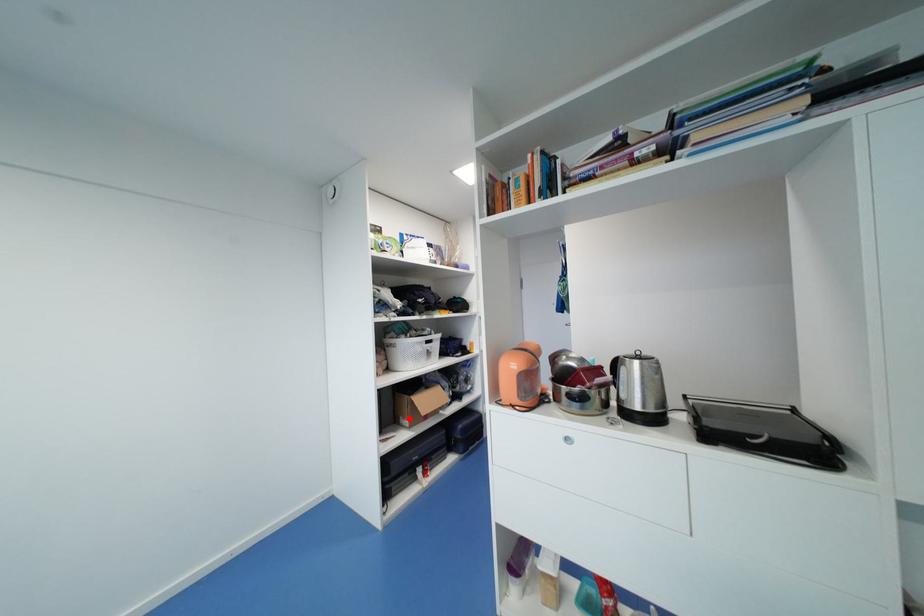
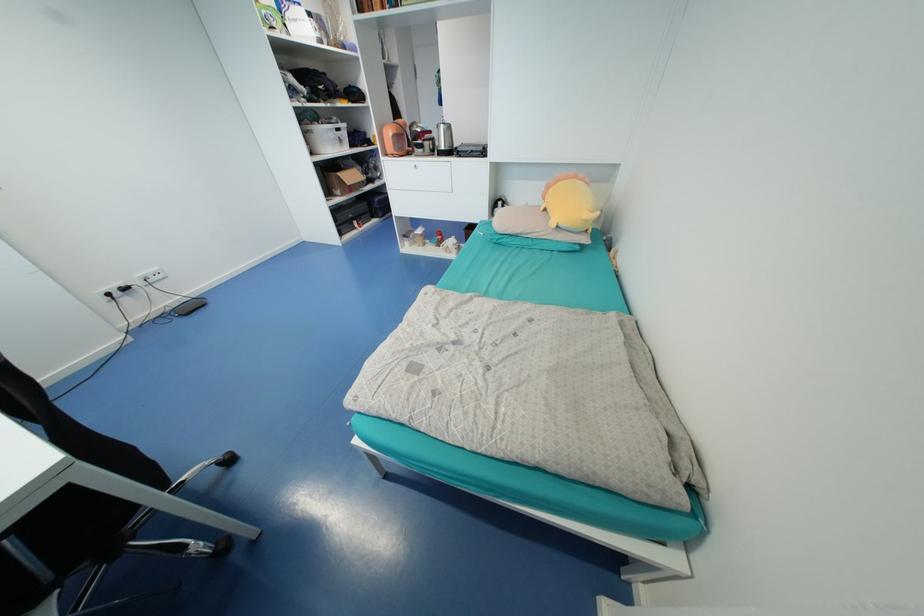
Question: I am providing you with two images of the same scene from different viewpoints. In image1, a red point is highlighted. Considering the same 3D point in image2, which of the following is correct?

Choices:
 (A) It is closer
 (B) It is farther

Answer: (A)